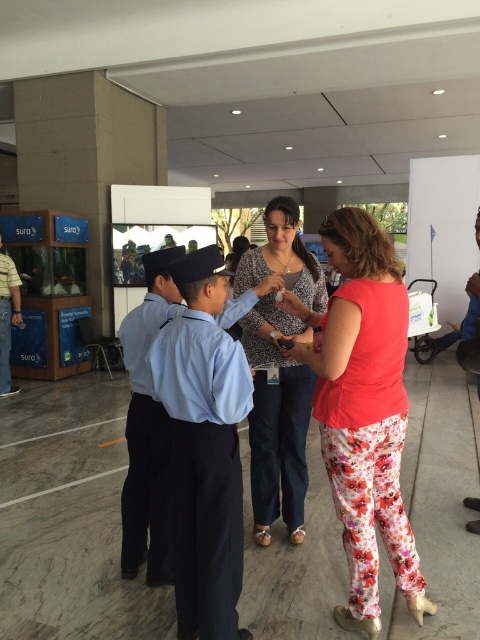
Question: Estimate the real-world distances between objects in this image. Which object is farther from the floral pants at center?

Choices:
 (A) light blue uniform at center
 (B) floral cotton pants at center

Answer: (A)

Question: Which of the following is the closest to the observer?

Choices:
 (A) floral cotton pants at center
 (B) light blue uniform at center
 (C) floral pants at center

Answer: (B)

Question: Is floral cotton pants at center behind floral pants at center?

Choices:
 (A) no
 (B) yes

Answer: (A)

Question: Does light blue uniform at center have a larger size compared to floral pants at center?

Choices:
 (A) yes
 (B) no

Answer: (B)

Question: Can you confirm if floral cotton pants at center is positioned below light blue uniform at center?

Choices:
 (A) yes
 (B) no

Answer: (B)

Question: Which object is the closest to the floral cotton pants at center?

Choices:
 (A) floral pants at center
 (B) light blue uniform at center

Answer: (B)